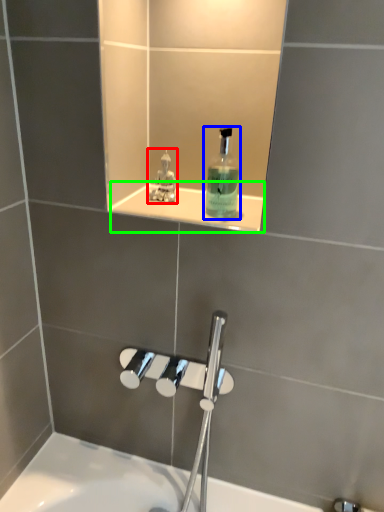
Question: Based on their relative distances, which object is nearer to perfume (highlighted by a red box)? Choose from mouthwash (highlighted by a blue box) and ledge (highlighted by a green box).

Choices:
 (A) mouthwash
 (B) ledge

Answer: (B)